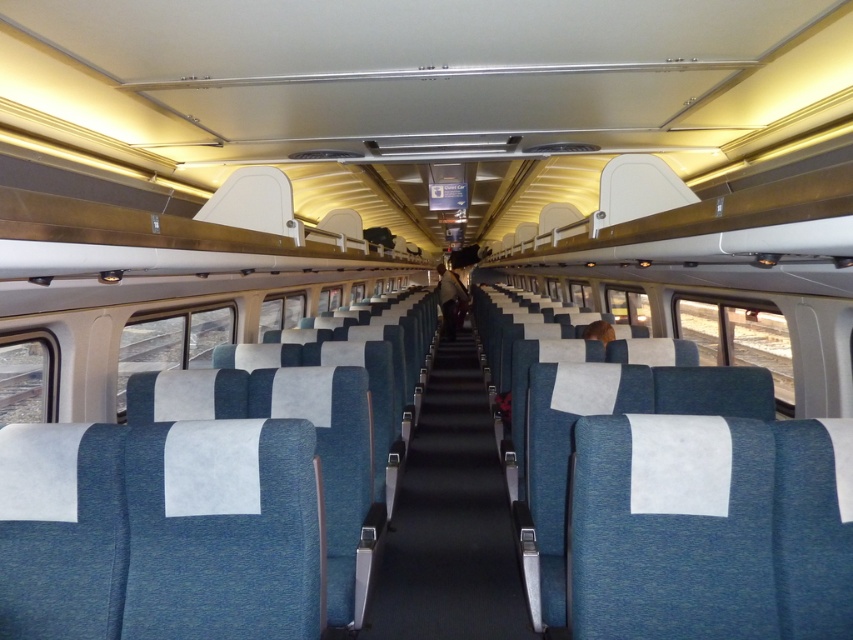
You are a passenger trying to stow a large backpack in the overhead compartments of the train car. You notice the blue fabric aisle at center and the blue fabric coach at center. Which of these two areas has lower clearance that might make it difficult to fit your backpack?

The blue fabric aisle at center has a lesser height compared to the blue fabric coach at center, so it has lower clearance which might make it difficult to fit your backpack.

You are a passenger on the train and want to store your backpack in the overhead compartment. You notice the blue fabric aisle at center and the blue fabric coach at center. Which one is closer to the overhead compartments?

The blue fabric coach at center is closer to the overhead compartments because the blue fabric aisle at center is located below it.